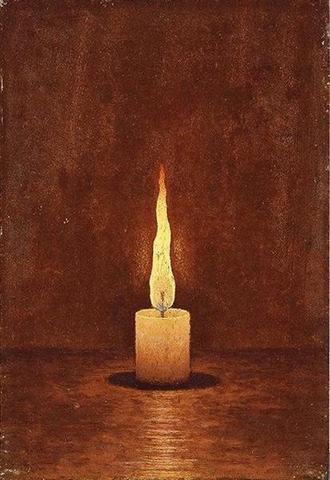
I want to click on lines made of candle light in the center floor, so click(160, 403), click(128, 452), click(151, 456), click(157, 461), click(174, 438), click(171, 430), click(167, 416).